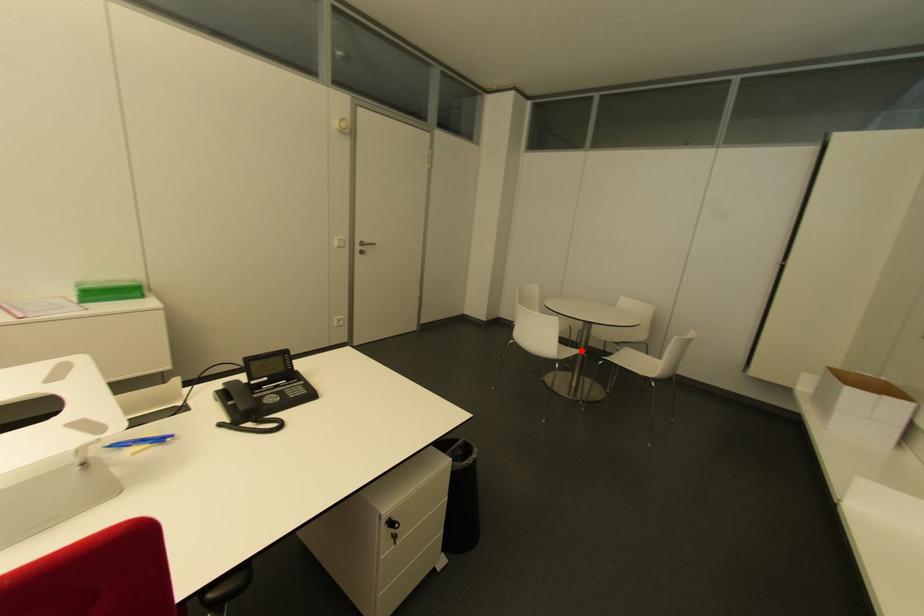
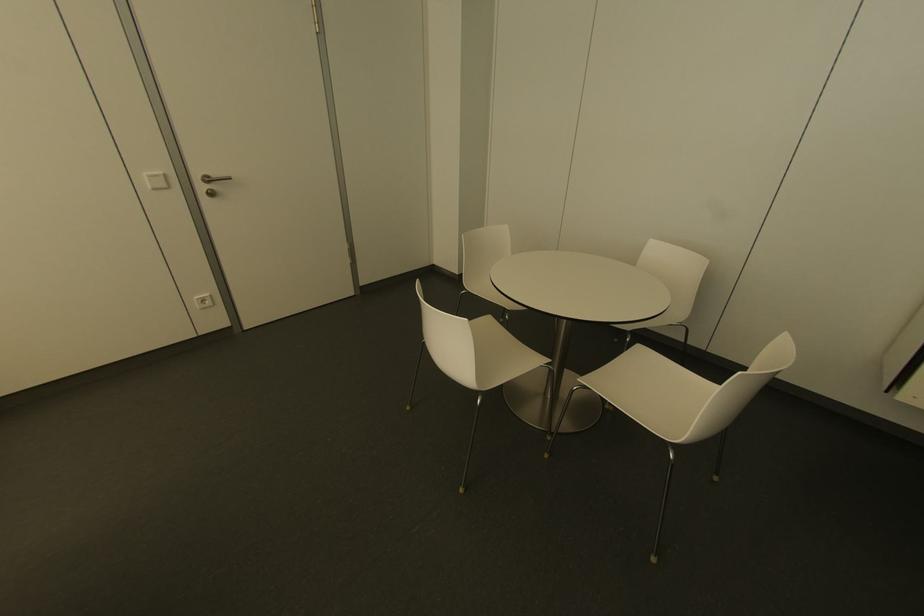
Find the pixel in the second image that matches the highlighted location in the first image.

(546, 361)